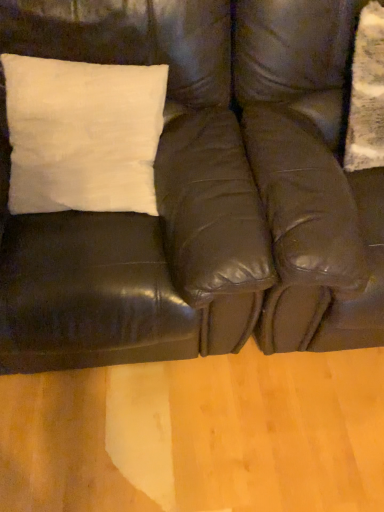
Question: Can you confirm if matte black swivel chair at right is shorter than matte black leather couch at upper left?

Choices:
 (A) no
 (B) yes

Answer: (A)

Question: From a real-world perspective, is matte black swivel chair at right under matte black leather couch at upper left?

Choices:
 (A) yes
 (B) no

Answer: (A)

Question: Can you confirm if matte black swivel chair at right is positioned to the left of matte black leather couch at upper left?

Choices:
 (A) yes
 (B) no

Answer: (B)

Question: Is matte black swivel chair at right behind matte black leather couch at upper left?

Choices:
 (A) yes
 (B) no

Answer: (A)

Question: From a real-world perspective, is matte black swivel chair at right physically above matte black leather couch at upper left?

Choices:
 (A) yes
 (B) no

Answer: (B)

Question: Is matte black swivel chair at right facing away from matte black leather couch at upper left?

Choices:
 (A) no
 (B) yes

Answer: (A)

Question: From a real-world perspective, is matte black leather couch at upper left physically below matte black swivel chair at right?

Choices:
 (A) no
 (B) yes

Answer: (A)

Question: Can you confirm if matte black leather couch at upper left is positioned to the left of matte black swivel chair at right?

Choices:
 (A) no
 (B) yes

Answer: (B)

Question: Is matte black leather couch at upper left oriented towards matte black swivel chair at right?

Choices:
 (A) no
 (B) yes

Answer: (A)

Question: Does matte black leather couch at upper left have a lesser height compared to matte black swivel chair at right?

Choices:
 (A) no
 (B) yes

Answer: (B)

Question: Can you confirm if matte black leather couch at upper left is smaller than matte black swivel chair at right?

Choices:
 (A) no
 (B) yes

Answer: (A)

Question: Considering the relative positions of matte black leather couch at upper left and matte black swivel chair at right in the image provided, is matte black leather couch at upper left to the right of matte black swivel chair at right from the viewer's perspective?

Choices:
 (A) yes
 (B) no

Answer: (B)

Question: In the image, is matte black leather couch at upper left on the left side or the right side of matte black swivel chair at right?

Choices:
 (A) left
 (B) right

Answer: (A)